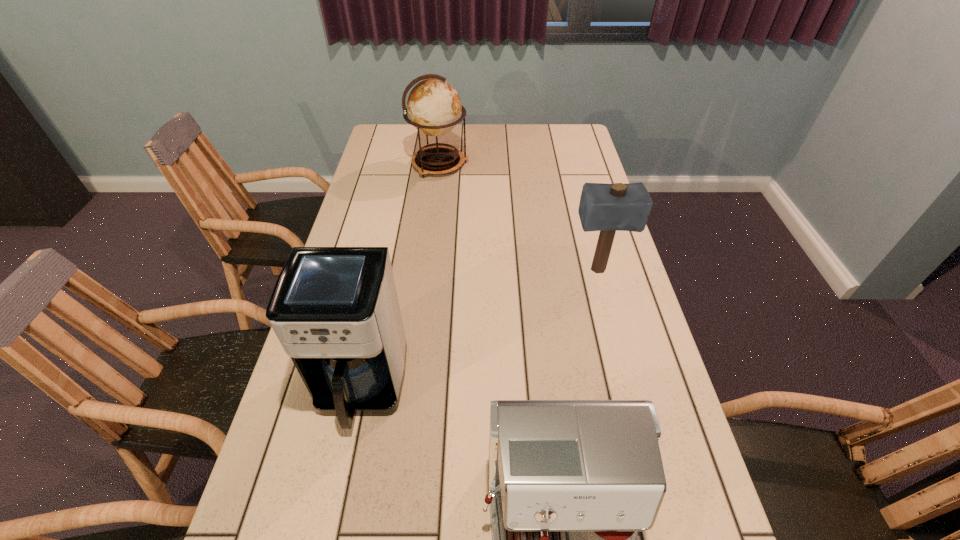
Image resolution: width=960 pixels, height=540 pixels. In order to click on the farthest object in this screenshot , I will do `click(434, 107)`.

The width and height of the screenshot is (960, 540). I want to click on the left coffee maker, so click(x=335, y=310).

Where is `the farther coffee maker`? the farther coffee maker is located at coordinates (335, 310).

Where is `the second farthest object`? The width and height of the screenshot is (960, 540). the second farthest object is located at coordinates [x=607, y=208].

Where is `vacant space located at the center of the globe`? vacant space located at the center of the globe is located at coordinates (492, 165).

Find the location of a particular element. blank space located 0.060m on the front panel of the farther coffee maker is located at coordinates (346, 466).

Locate an element on the screen. vacant space situated 0.180m on the left of the mallet is located at coordinates (508, 270).

Locate an element on the screen. object that is at the far edge is located at coordinates (434, 107).

This screenshot has height=540, width=960. In order to click on globe that is positioned at the left edge in this screenshot , I will do `click(434, 107)`.

You are a GUI agent. You are given a task and a screenshot of the screen. Output one action in this format:
    pyautogui.click(x=<x>, y=<y>)
    Task: Click on the coffee maker at the left edge
    This screenshot has width=960, height=540.
    Given the screenshot: What is the action you would take?
    pyautogui.click(x=335, y=310)